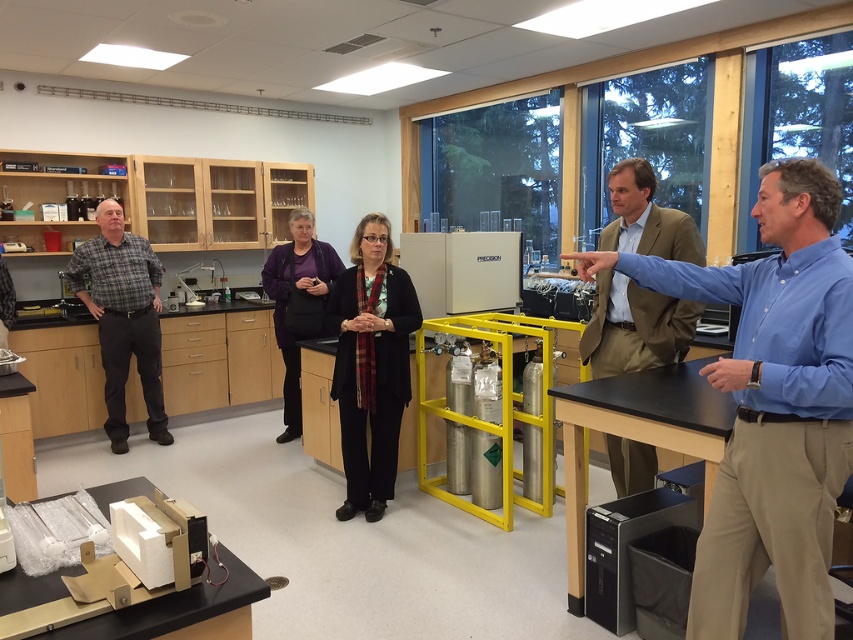
Question: Can you confirm if black fabric coat at center is bigger than purple fabric jacket at center?

Choices:
 (A) no
 (B) yes

Answer: (A)

Question: Which object is the closest to the blue shirt at center?

Choices:
 (A) plaid shirt at left
 (B) khaki cotton blazer at center
 (C) black fabric coat at center
 (D) purple fabric jacket at center

Answer: (B)

Question: Does blue shirt at center have a larger size compared to khaki cotton blazer at center?

Choices:
 (A) no
 (B) yes

Answer: (B)

Question: Does blue shirt at center have a lesser width compared to plaid shirt at left?

Choices:
 (A) no
 (B) yes

Answer: (A)

Question: Which of the following is the closest to the observer?

Choices:
 (A) khaki cotton blazer at center
 (B) plaid shirt at left
 (C) blue shirt at center
 (D) black fabric coat at center

Answer: (C)

Question: Which of the following is the closest to the observer?

Choices:
 (A) black fabric coat at center
 (B) khaki cotton blazer at center

Answer: (B)